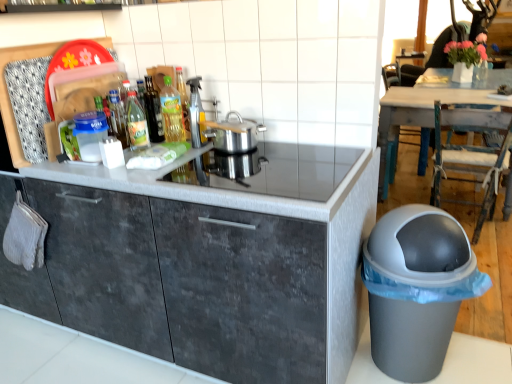
Question: In terms of width, does wooden rustic table at upper right look wider or thinner when compared to green glass bottle at center, placed as the 1th bottle when sorted from right to left?

Choices:
 (A) thin
 (B) wide

Answer: (B)

Question: From their relative heights in the image, would you say wooden rustic table at upper right is taller or shorter than green glass bottle at center, placed as the 3th bottle when sorted from left to right?

Choices:
 (A) tall
 (B) short

Answer: (A)

Question: Which of these objects is positioned closest to the translucent plastic spray bottle at center?

Choices:
 (A) translucent glass bottle at center, positioned as the second bottle in right-to-left order
 (B) rustic wood chair at right, the 2th chair in the back-to-front sequence
 (C) green glass bottle at center, placed as the 1th bottle when sorted from right to left
 (D) gray plastic waste bin at lower right
 (E) wooden rustic table at upper right

Answer: (C)

Question: Based on their relative distances, which object is nearer to the dark gray concrete cabinet at center?

Choices:
 (A) translucent glass bottle at center, the 2th bottle from the left
 (B) green glass bottle at center, placed as the 1th bottle when sorted from right to left
 (C) wooden rustic table at upper right
 (D) rustic wood chair at right, which ranks as the first chair in front-to-back order
 (E) gray plastic waste bin at lower right

Answer: (E)